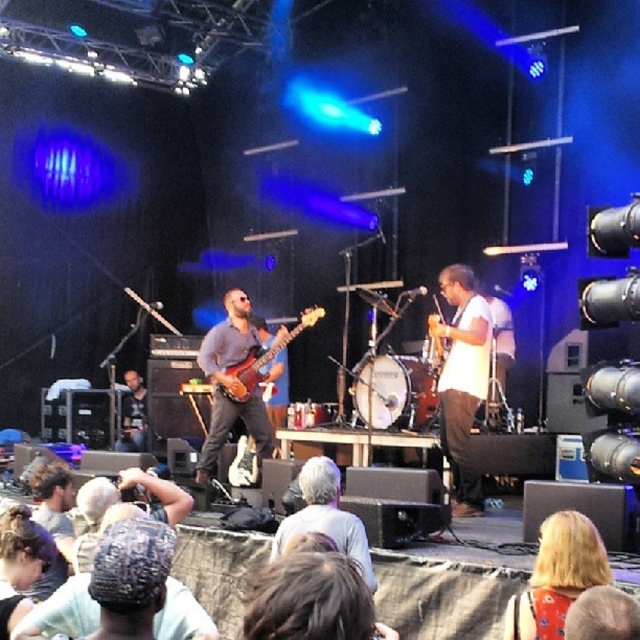
Question: Which point is farther from the camera taking this photo?

Choices:
 (A) (332, 486)
 (B) (461, 410)
 (C) (582, 544)
 (D) (285, 632)

Answer: (B)

Question: Can you confirm if brown hair at center is positioned below white matte guitar at center?

Choices:
 (A) yes
 (B) no

Answer: (A)

Question: Considering the real-world distances, which object is farthest from the matte brown guitar at center?

Choices:
 (A) brown hair at center
 (B) white matte guitar at center
 (C) brown wood electric guitar at center
 (D) blonde hair at lower right

Answer: (A)

Question: From the image, what is the correct spatial relationship of white matte guitar at center in relation to gray fabric at center?

Choices:
 (A) left
 (B) right

Answer: (B)

Question: Which of the following is the farthest from the observer?

Choices:
 (A) (296, 616)
 (B) (586, 529)
 (C) (218, 384)
 (D) (355, 554)

Answer: (C)

Question: Does brown hair at center have a lesser width compared to matte brown guitar at center?

Choices:
 (A) no
 (B) yes

Answer: (B)